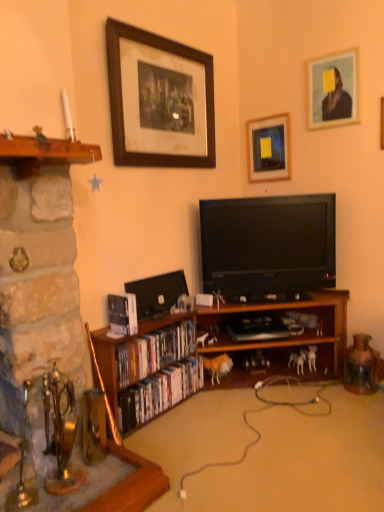
Where is `free space in front of rusty metal jug at lower right`? The image size is (384, 512). free space in front of rusty metal jug at lower right is located at coordinates (364, 404).